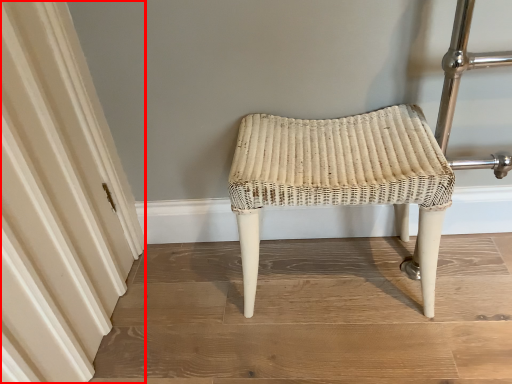
Question: In this image, where is curtain (annotated by the red box) located relative to stool?

Choices:
 (A) left
 (B) right

Answer: (A)